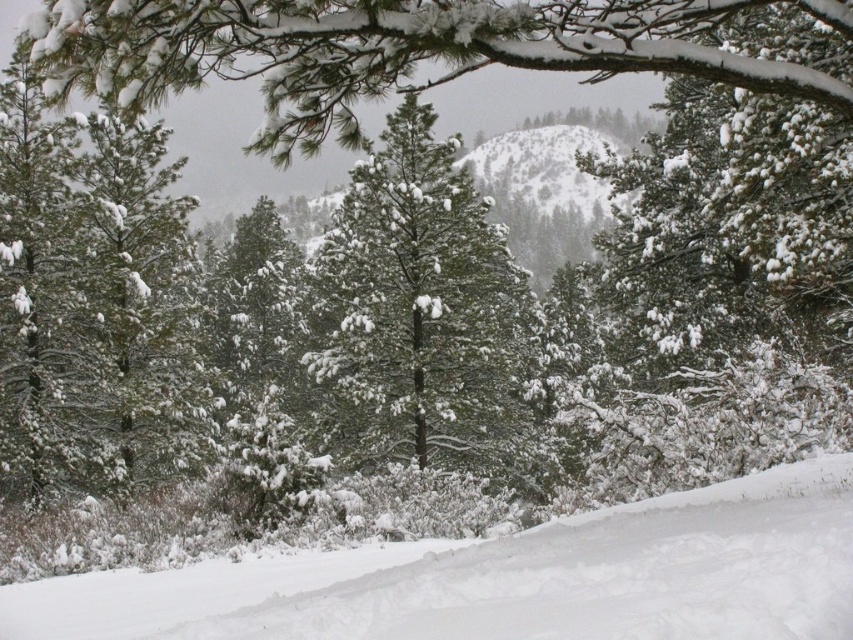
Question: Is white snow ski slope at lower center in front of green matte tree at center?

Choices:
 (A) no
 (B) yes

Answer: (B)

Question: Which of the following is the closest to the observer?

Choices:
 (A) (489, 589)
 (B) (332, 336)

Answer: (A)

Question: Can you confirm if white snow ski slope at lower center is positioned to the left of green matte tree at center?

Choices:
 (A) yes
 (B) no

Answer: (B)

Question: Among these objects, which one is nearest to the camera?

Choices:
 (A) white snow ski slope at lower center
 (B) green matte tree at center

Answer: (A)

Question: Does white snow ski slope at lower center have a greater width compared to green matte tree at center?

Choices:
 (A) no
 (B) yes

Answer: (B)